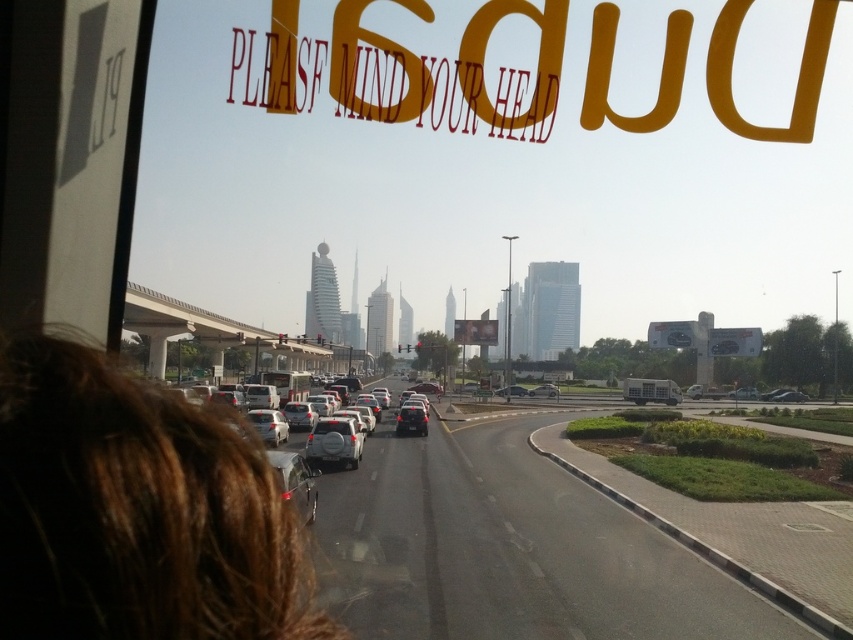
You are a passenger in the vehicle and notice two shiny silver vehicles ahead on the road. Which one is taller between the shiny silver car at center and the shiny silver sedan at center?

The shiny silver car at center is taller than the shiny silver sedan at center.

You are inside a car and looking at the road ahead. There are two points marked on the road at coordinates point (468, 456) and point (361, 451). Which point is closer to you?

Point (468, 456) is further to the viewer than point (361, 451), so the point closer to you is point (361, 451).